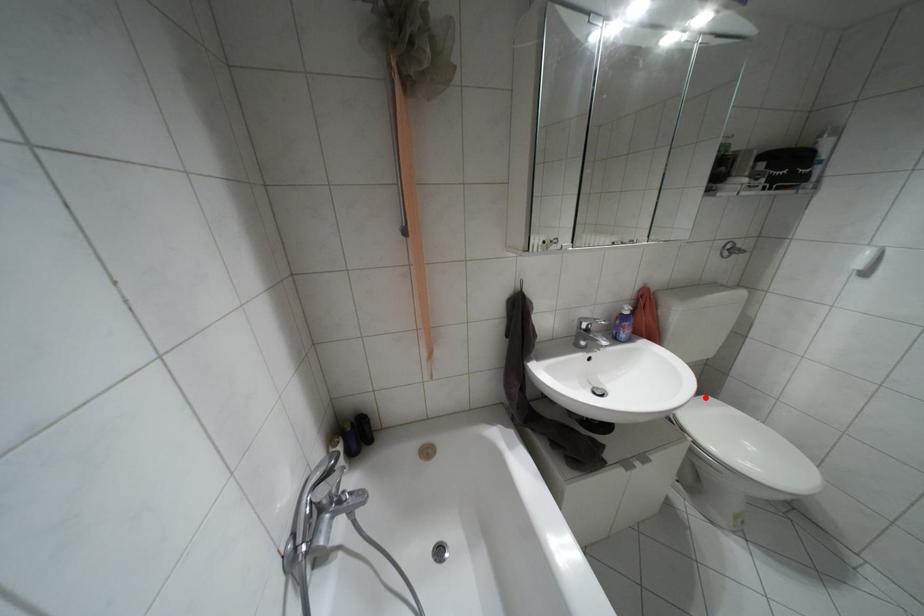
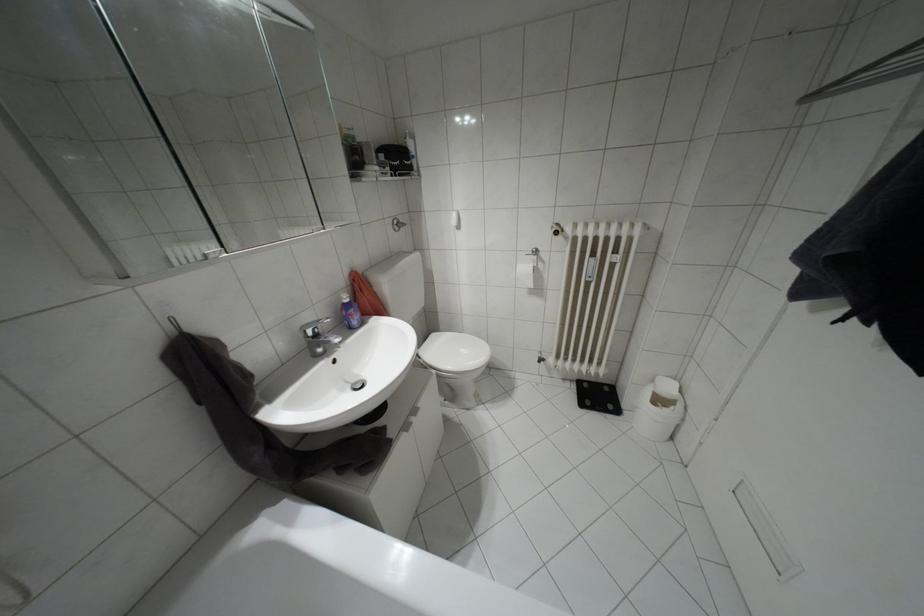
The point at the highlighted location is marked in the first image. Where is the corresponding point in the second image?

(432, 334)